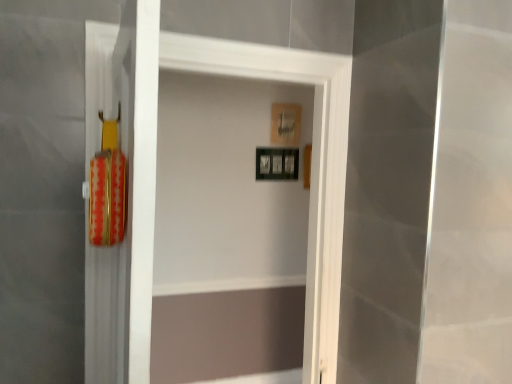
Question: Considering their positions, is wooden picture frame at upper center, which appears as the second picture frame when ordered from the bottom, located in front of or behind black matte picture frame at center, which appears as the first picture frame when ordered from the bottom?

Choices:
 (A) front
 (B) behind

Answer: (B)

Question: Is wooden picture frame at upper center, which appears as the second picture frame when ordered from the bottom, to the left or to the right of black matte picture frame at center, which appears as the first picture frame when ordered from the bottom, in the image?

Choices:
 (A) left
 (B) right

Answer: (B)

Question: Is wooden picture frame at upper center, marked as the first picture frame in a top-to-bottom arrangement, wider or thinner than black matte picture frame at center, which appears as the first picture frame when ordered from the bottom?

Choices:
 (A) thin
 (B) wide

Answer: (A)

Question: In terms of height, does black matte picture frame at center, arranged as the 2th picture frame when viewed from the top, look taller or shorter compared to wooden picture frame at upper center, which appears as the second picture frame when ordered from the bottom?

Choices:
 (A) tall
 (B) short

Answer: (B)

Question: Looking at their shapes, would you say black matte picture frame at center, which appears as the first picture frame when ordered from the bottom, is wider or thinner than wooden picture frame at upper center, marked as the first picture frame in a top-to-bottom arrangement?

Choices:
 (A) thin
 (B) wide

Answer: (B)

Question: Considering the positions of point (260, 155) and point (276, 137), is point (260, 155) closer or farther from the camera than point (276, 137)?

Choices:
 (A) closer
 (B) farther

Answer: (A)

Question: From a real-world perspective, relative to wooden picture frame at upper center, which appears as the second picture frame when ordered from the bottom, is black matte picture frame at center, which appears as the first picture frame when ordered from the bottom, vertically above or below?

Choices:
 (A) below
 (B) above

Answer: (A)